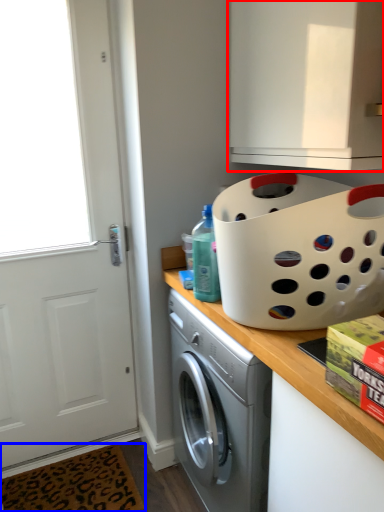
Question: Which point is further to the camera, cabinetry (highlighted by a red box) or doormat (highlighted by a blue box)?

Choices:
 (A) cabinetry
 (B) doormat

Answer: (B)